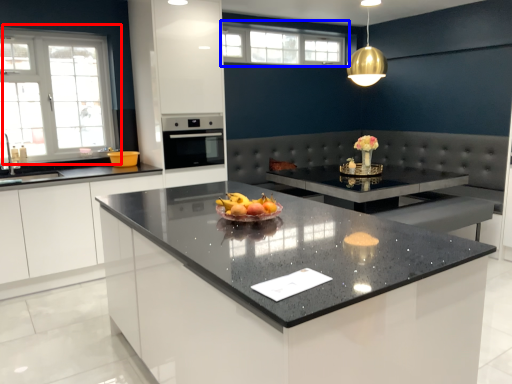
Question: Which of the following is the closest to the observer, window (highlighted by a red box) or window (highlighted by a blue box)?

Choices:
 (A) window
 (B) window

Answer: (A)